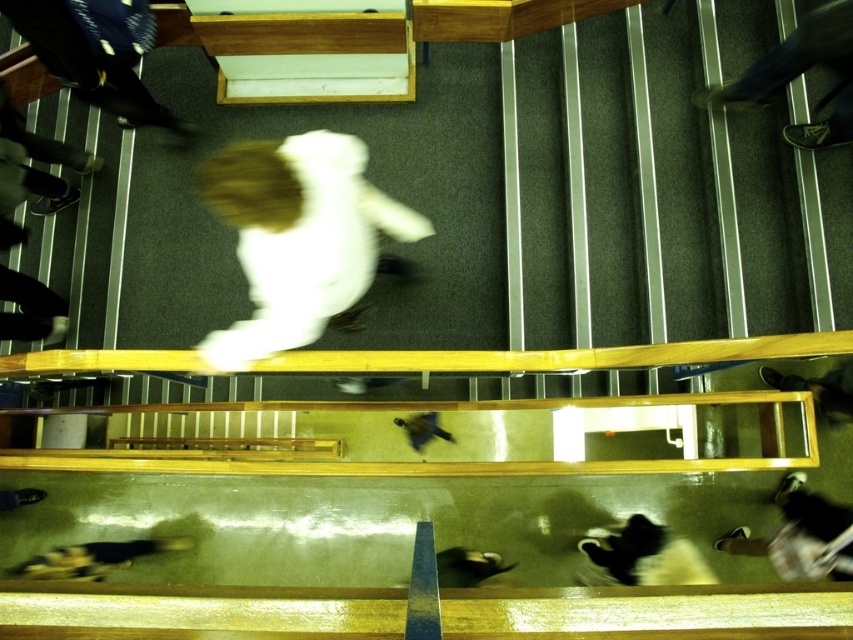
Question: Is dark blue jeans at upper left further to the viewer compared to dark blue jeans at upper right?

Choices:
 (A) yes
 (B) no

Answer: (A)

Question: Which of the following is the closest to the observer?

Choices:
 (A) (840, 387)
 (B) (306, 132)

Answer: (A)

Question: Which of these objects is positioned farthest from the dark brown leather shoes at lower right?

Choices:
 (A) black fur dog at lower left
 (B) white fluffy coat at center
 (C) dark blue jeans at upper right
 (D) dark blue jeans at upper left

Answer: (D)

Question: Is white fluffy coat at center bigger than dark brown leather shoes at lower right?

Choices:
 (A) yes
 (B) no

Answer: (A)

Question: Estimate the real-world distances between objects in this image. Which object is farther from the dark blue jeans at upper left?

Choices:
 (A) dark blue jeans at upper right
 (B) white fluffy coat at center
 (C) dark brown leather shoes at lower right
 (D) black fur dog at lower left

Answer: (C)

Question: Can you confirm if white fluffy coat at center is positioned to the right of dark blue jeans at upper left?

Choices:
 (A) no
 (B) yes

Answer: (B)